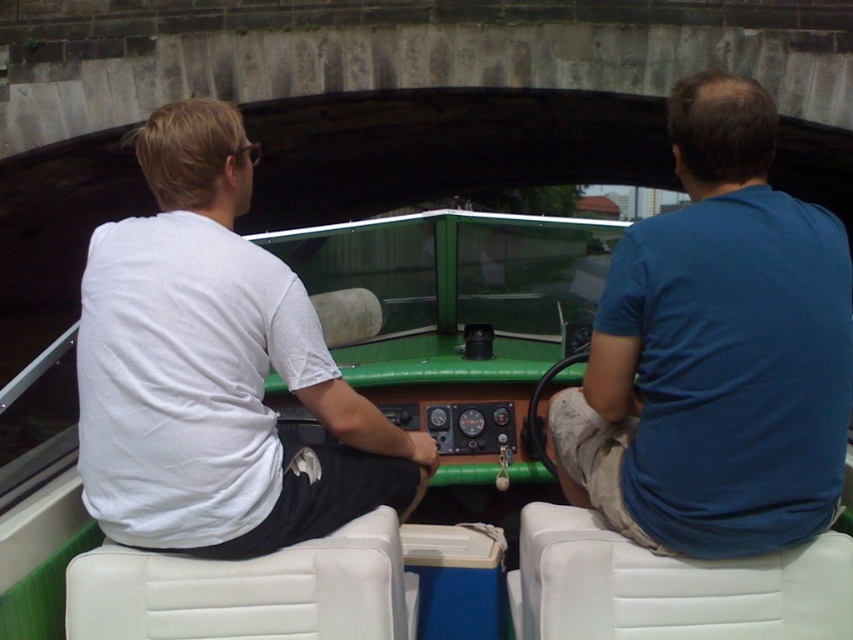
Question: Which of the following is the closest to the observer?

Choices:
 (A) blue cotton shirt at right
 (B) white cotton shirt at left

Answer: (A)

Question: Does blue cotton shirt at right have a smaller size compared to white cotton shirt at left?

Choices:
 (A) no
 (B) yes

Answer: (A)

Question: Among these points, which one is farthest from the camera?

Choices:
 (A) (296, 323)
 (B) (837, 275)

Answer: (A)

Question: Where is blue cotton shirt at right located in relation to white cotton shirt at left in the image?

Choices:
 (A) left
 (B) right

Answer: (B)

Question: Does blue cotton shirt at right have a smaller size compared to white cotton shirt at left?

Choices:
 (A) no
 (B) yes

Answer: (A)